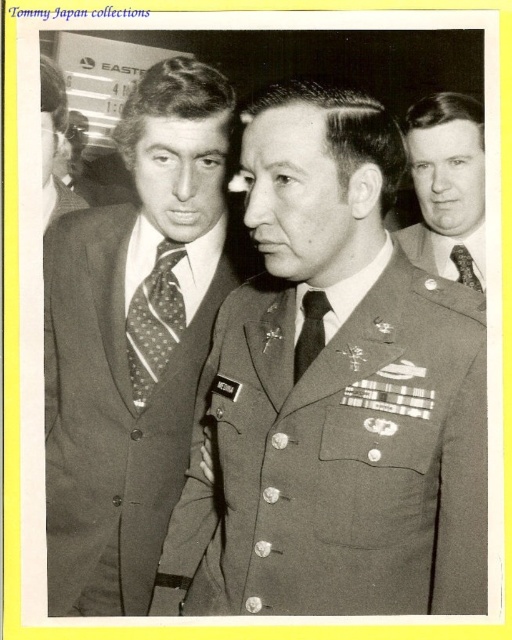
Locate an element on the screen. This screenshot has height=640, width=512. polka dot silk tie at left is located at coordinates (154, 323).

Is polished dark suit at center further to the viewer compared to polka dot silk tie at center?

No.

Can you confirm if polished dark suit at center is wider than polka dot silk tie at center?

Correct, the width of polished dark suit at center exceeds that of polka dot silk tie at center.

Is point (175, 401) farther from camera compared to point (458, 260)?

No, (175, 401) is closer to viewer.

You are a GUI agent. You are given a task and a screenshot of the screen. Output one action in this format:
    pyautogui.click(x=<x>, y=<y>)
    Task: Click on the polished dark suit at center
    
    Given the screenshot: What is the action you would take?
    pyautogui.click(x=134, y=340)

Who is taller, matte black suit at center or polka dot tie at left?

matte black suit at center

Does point (320, 460) come closer to viewer compared to point (50, 104)?

That is True.

Locate an element on the screen. matte black suit at center is located at coordinates (333, 396).